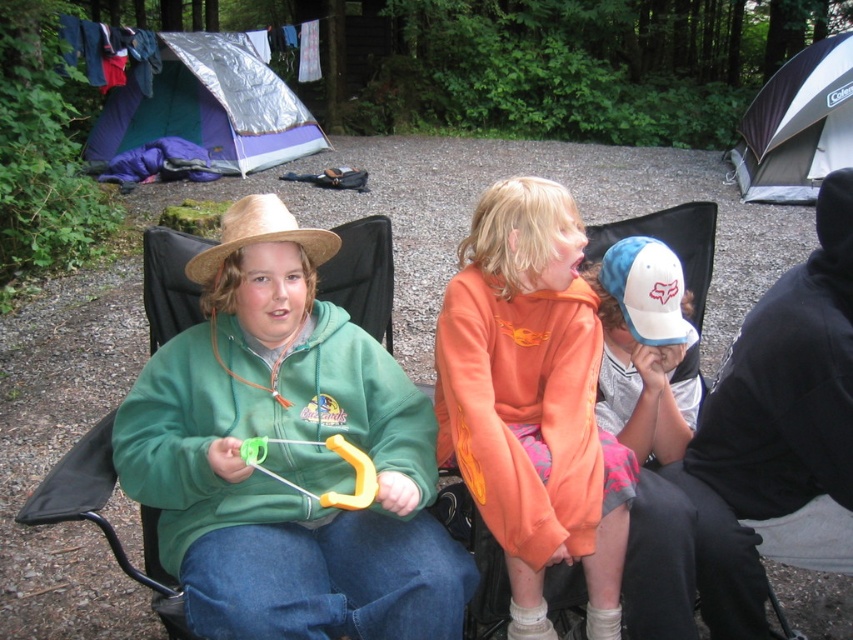
Question: Can you confirm if orange fleece sweatshirt at center is positioned to the left of blue tarp tent at upper left?

Choices:
 (A) yes
 (B) no

Answer: (B)

Question: Is orange fleece sweatshirt at center below strawmaterial/texturehat at left?

Choices:
 (A) no
 (B) yes

Answer: (B)

Question: Which of the following is the closest to the observer?

Choices:
 (A) (740, 157)
 (B) (302, 236)
 (C) (216, 60)
 (D) (376, 477)

Answer: (D)

Question: Which point is closer to the camera taking this photo?

Choices:
 (A) (206, 467)
 (B) (517, 268)
 (C) (244, 237)
 (D) (766, 163)

Answer: (A)

Question: Can you confirm if green fleece hoodie at center is positioned below orange fleece sweatshirt at center?

Choices:
 (A) no
 (B) yes

Answer: (B)

Question: Which point is farther to the camera?

Choices:
 (A) pyautogui.click(x=225, y=227)
 (B) pyautogui.click(x=131, y=96)

Answer: (B)